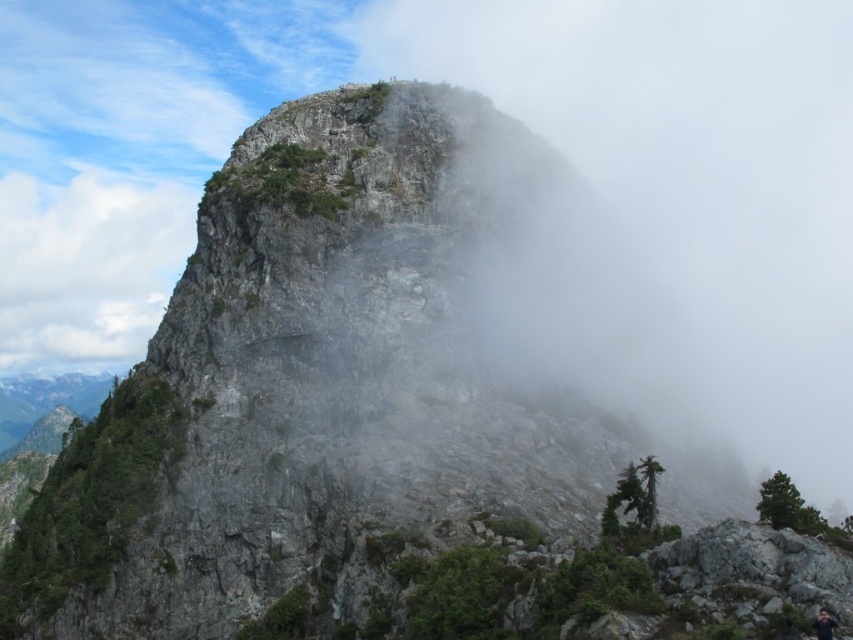
Question: Which object appears farthest from the camera in this image?

Choices:
 (A) white misty cloud at upper center
 (B) white fluffy cloud at upper left
 (C) dark gray fabric hiker at lower right

Answer: (B)

Question: Is white misty cloud at upper center above white fluffy cloud at upper left?

Choices:
 (A) no
 (B) yes

Answer: (B)

Question: Does white misty cloud at upper center appear on the left side of dark gray fabric hiker at lower right?

Choices:
 (A) yes
 (B) no

Answer: (B)

Question: Which of the following is the farthest from the observer?

Choices:
 (A) click(x=802, y=392)
 (B) click(x=820, y=621)

Answer: (A)

Question: Does white misty cloud at upper center have a larger size compared to white fluffy cloud at upper left?

Choices:
 (A) yes
 (B) no

Answer: (B)

Question: Which point is farther to the camera?

Choices:
 (A) (752, 218)
 (B) (68, 268)

Answer: (B)